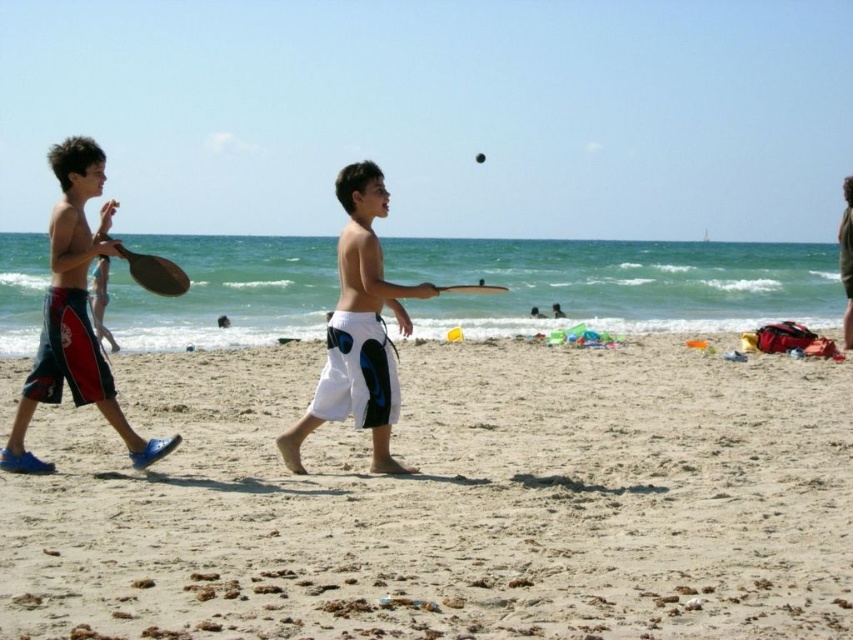
Question: Which object is closer to the camera taking this photo?

Choices:
 (A) smooth sand at lower center
 (B) blue fabric shorts at left
 (C) green cotton shorts at center

Answer: (A)

Question: Which point is farther to the camera?

Choices:
 (A) [x=850, y=280]
 (B) [x=746, y=500]
 (C) [x=366, y=282]
 (D) [x=148, y=452]

Answer: (A)

Question: Which object appears closest to the camera in this image?

Choices:
 (A) blue fabric shorts at left
 (B) smooth sand at lower center
 (C) white cotton shorts at center
 (D) green cotton shorts at center

Answer: (B)

Question: Is the position of smooth sand at lower center more distant than that of white cotton shorts at center?

Choices:
 (A) yes
 (B) no

Answer: (B)

Question: Does smooth sand at lower center have a larger size compared to white cotton shorts at center?

Choices:
 (A) yes
 (B) no

Answer: (B)

Question: Is smooth sand at lower center above green cotton shorts at center?

Choices:
 (A) no
 (B) yes

Answer: (A)